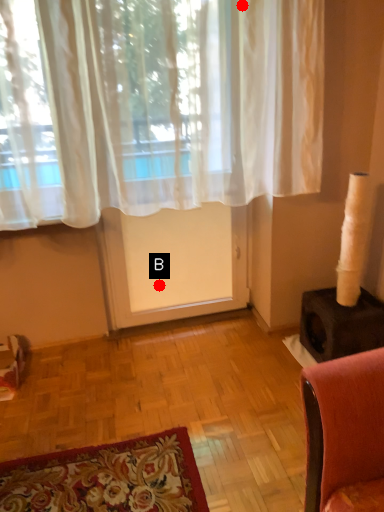
Question: Two points are circled on the image, labeled by A and B beside each circle. Which point is further to the camera?

Choices:
 (A) A is further
 (B) B is further

Answer: (B)